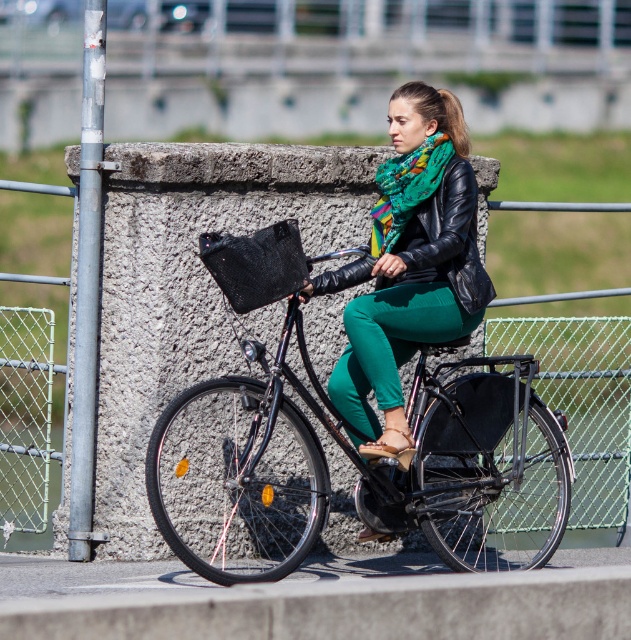
Question: Considering the relative positions of black leather jacket at center and multicolored knitted scarf at center in the image provided, where is black leather jacket at center located with respect to multicolored knitted scarf at center?

Choices:
 (A) below
 (B) above

Answer: (A)

Question: Which object is positioned closest to the black leather jacket at center?

Choices:
 (A) green matte scarf at center
 (B) multicolored knitted scarf at center
 (C) shiny black bicycle at center

Answer: (A)

Question: Observing the image, what is the correct spatial positioning of shiny black bicycle at center in reference to black leather jacket at center?

Choices:
 (A) below
 (B) above

Answer: (A)

Question: Does green matte scarf at center have a smaller size compared to black leather jacket at center?

Choices:
 (A) no
 (B) yes

Answer: (A)

Question: Among these points, which one is farthest from the camera?

Choices:
 (A) pos(374,241)
 (B) pos(391,528)
 (C) pos(444,177)

Answer: (A)

Question: Which of these objects is positioned closest to the multicolored knitted scarf at center?

Choices:
 (A) green matte scarf at center
 (B) black leather jacket at center
 (C) shiny black bicycle at center

Answer: (A)